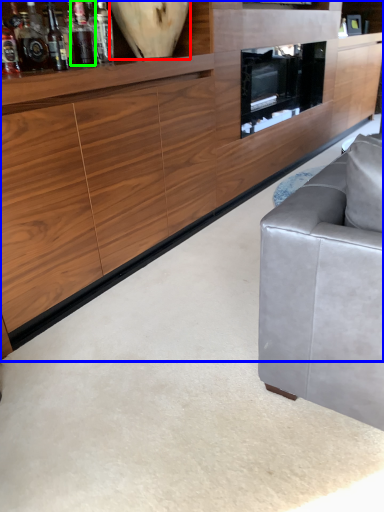
Question: Estimate the real-world distances between objects in this image. Which object is closer to vase (highlighted by a red box), cabinetry (highlighted by a blue box) or bottle (highlighted by a green box)?

Choices:
 (A) cabinetry
 (B) bottle

Answer: (B)